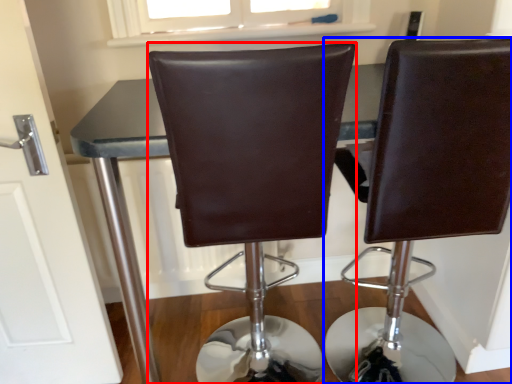
Question: Which point is closer to the camera, chair (highlighted by a red box) or chair (highlighted by a blue box)?

Choices:
 (A) chair
 (B) chair

Answer: (A)